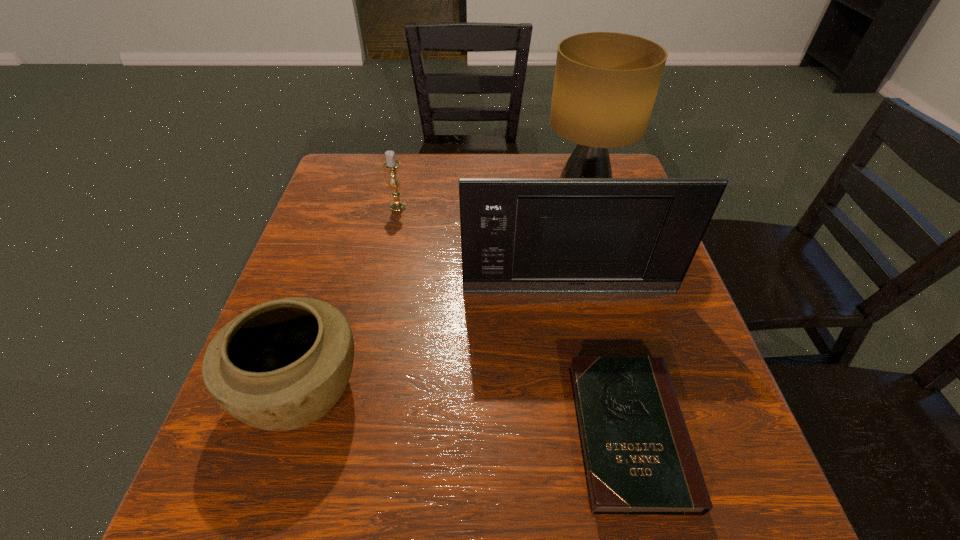
Identify the location of the tallest object. (605, 85).

What are the coordinates of `microwave oven` in the screenshot? It's located at (x=518, y=235).

This screenshot has height=540, width=960. What are the coordinates of `the third nearest object` in the screenshot? It's located at (518, 235).

The width and height of the screenshot is (960, 540). I want to click on candle holder, so click(390, 164).

Find the location of a particular element. pottery is located at coordinates (281, 365).

Locate an element on the screen. The width and height of the screenshot is (960, 540). the shortest object is located at coordinates (638, 456).

What are the coordinates of `vacant space located 0.330m on the left of the tallest object` in the screenshot? It's located at (417, 198).

Find the location of a particular element. The image size is (960, 540). vacant area located on the front panel of the microwave oven is located at coordinates (580, 344).

Identify the location of vacant point located 0.100m on the left of the candle holder. (351, 206).

Image resolution: width=960 pixels, height=540 pixels. Find the location of `blank area located on the back of the pottery`. blank area located on the back of the pottery is located at coordinates (329, 299).